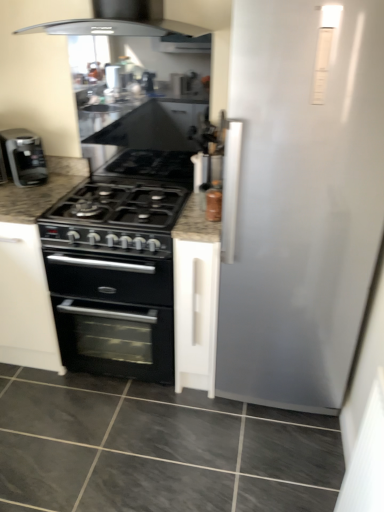
Question: Considering the relative positions of gray marble floor at lower center and black matte coffee machine at left in the image provided, is gray marble floor at lower center to the left of black matte coffee machine at left from the viewer's perspective?

Choices:
 (A) yes
 (B) no

Answer: (B)

Question: Is gray marble floor at lower center far away from black matte coffee machine at left?

Choices:
 (A) no
 (B) yes

Answer: (B)

Question: Considering the relative sizes of gray marble floor at lower center and black matte coffee machine at left in the image provided, is gray marble floor at lower center taller than black matte coffee machine at left?

Choices:
 (A) yes
 (B) no

Answer: (B)

Question: Considering the relative sizes of gray marble floor at lower center and black matte coffee machine at left in the image provided, is gray marble floor at lower center shorter than black matte coffee machine at left?

Choices:
 (A) yes
 (B) no

Answer: (A)

Question: Is gray marble floor at lower center looking in the opposite direction of black matte coffee machine at left?

Choices:
 (A) no
 (B) yes

Answer: (A)

Question: Relative to black matte coffee machine at left, is gray marble floor at lower center in front or behind?

Choices:
 (A) front
 (B) behind

Answer: (A)

Question: From a real-world perspective, relative to black matte coffee machine at left, is gray marble floor at lower center vertically above or below?

Choices:
 (A) below
 (B) above

Answer: (A)

Question: From the image's perspective, is gray marble floor at lower center located above or below black matte coffee machine at left?

Choices:
 (A) below
 (B) above

Answer: (A)

Question: Would you say gray marble floor at lower center is to the left or to the right of black matte coffee machine at left in the picture?

Choices:
 (A) right
 (B) left

Answer: (A)

Question: Considering the positions of point (51, 278) and point (195, 154), is point (51, 278) closer or farther from the camera than point (195, 154)?

Choices:
 (A) farther
 (B) closer

Answer: (B)

Question: From their relative heights in the image, would you say black granite countertop at center is taller or shorter than metallic silver spice jar at upper right?

Choices:
 (A) short
 (B) tall

Answer: (B)

Question: In the image, is black granite countertop at center positioned in front of or behind metallic silver spice jar at upper right?

Choices:
 (A) front
 (B) behind

Answer: (A)

Question: In terms of size, does black granite countertop at center appear bigger or smaller than metallic silver spice jar at upper right?

Choices:
 (A) small
 (B) big

Answer: (B)

Question: From a real-world perspective, relative to black granite countertop at center, is gray marble floor at lower center vertically above or below?

Choices:
 (A) above
 (B) below

Answer: (B)

Question: Based on their sizes in the image, would you say gray marble floor at lower center is bigger or smaller than black granite countertop at center?

Choices:
 (A) big
 (B) small

Answer: (B)